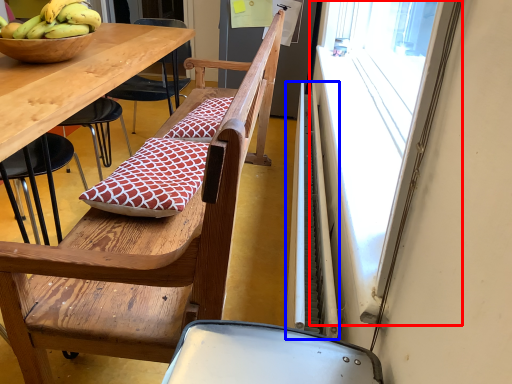
Question: Which of the following is the closest to the observer, window screen (highlighted by a red box) or radiator (highlighted by a blue box)?

Choices:
 (A) window screen
 (B) radiator

Answer: (A)